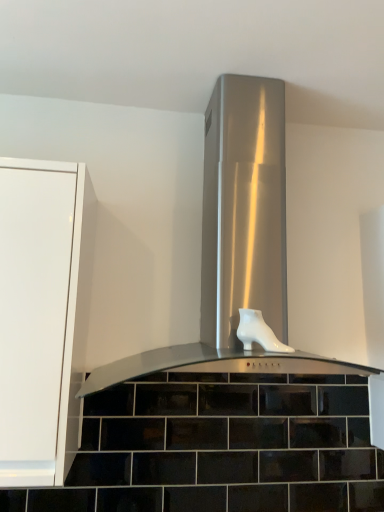
Question: Is stainless steel range hood at center further to camera compared to white glossy boot at center?

Choices:
 (A) no
 (B) yes

Answer: (A)

Question: From a real-world perspective, does stainless steel range hood at center stand above white glossy boot at center?

Choices:
 (A) no
 (B) yes

Answer: (B)

Question: From the image's perspective, is stainless steel range hood at center located beneath white glossy boot at center?

Choices:
 (A) yes
 (B) no

Answer: (B)

Question: Can you confirm if stainless steel range hood at center is bigger than white glossy boot at center?

Choices:
 (A) no
 (B) yes

Answer: (B)

Question: Does stainless steel range hood at center have a smaller size compared to white glossy boot at center?

Choices:
 (A) no
 (B) yes

Answer: (A)

Question: Considering the relative sizes of stainless steel range hood at center and white glossy boot at center in the image provided, is stainless steel range hood at center thinner than white glossy boot at center?

Choices:
 (A) yes
 (B) no

Answer: (B)

Question: Is white glossy boot at center behind stainless steel range hood at center?

Choices:
 (A) yes
 (B) no

Answer: (A)

Question: Is stainless steel range hood at center completely or partially inside white glossy boot at center?

Choices:
 (A) no
 (B) yes

Answer: (A)

Question: Can you confirm if white glossy boot at center is positioned to the left of stainless steel range hood at center?

Choices:
 (A) yes
 (B) no

Answer: (B)

Question: Is white glossy boot at center outside of stainless steel range hood at center?

Choices:
 (A) yes
 (B) no

Answer: (B)

Question: Is white glossy boot at center turned away from stainless steel range hood at center?

Choices:
 (A) no
 (B) yes

Answer: (B)

Question: Does white glossy boot at center have a larger size compared to stainless steel range hood at center?

Choices:
 (A) yes
 (B) no

Answer: (B)

Question: Looking at the image, does white glossy boot at center seem bigger or smaller compared to stainless steel range hood at center?

Choices:
 (A) big
 (B) small

Answer: (B)